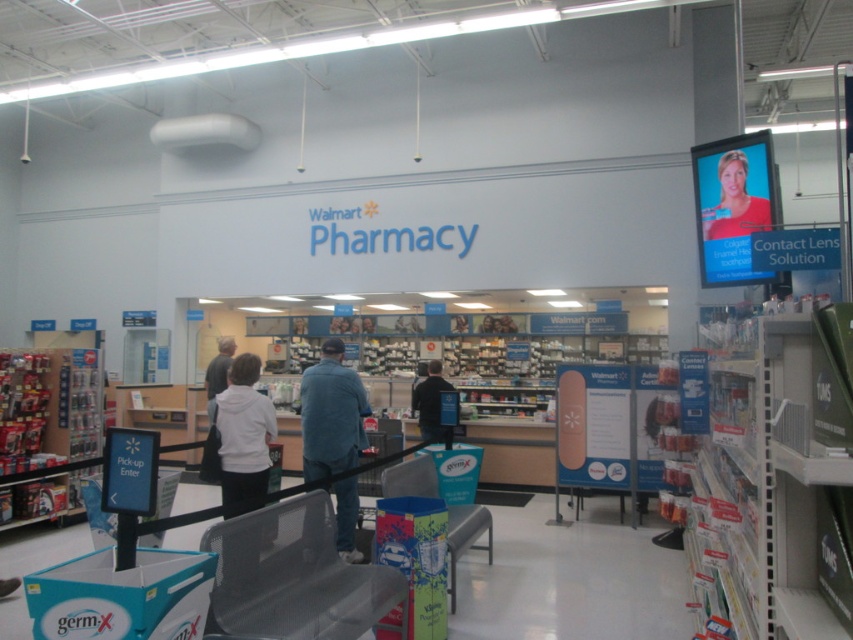
Question: Based on their relative distances, which object is nearer to the white matte jacket at center?

Choices:
 (A) denim blue jeans at center
 (B) smooth skin face at upper right
 (C) dark blue jeans at center

Answer: (A)

Question: Does smooth skin face at upper right lie behind dark blue jeans at center?

Choices:
 (A) no
 (B) yes

Answer: (A)

Question: Which point is closer to the camera taking this photo?

Choices:
 (A) (257, 369)
 (B) (741, 164)
 (C) (355, 403)

Answer: (A)

Question: Is smooth skin face at upper right above dark blue jeans at center?

Choices:
 (A) yes
 (B) no

Answer: (A)

Question: Among these objects, which one is farthest from the camera?

Choices:
 (A) denim blue jeans at center
 (B) white matte jacket at center

Answer: (A)

Question: Can you confirm if denim blue jeans at center is positioned to the right of white matte jacket at center?

Choices:
 (A) no
 (B) yes

Answer: (B)